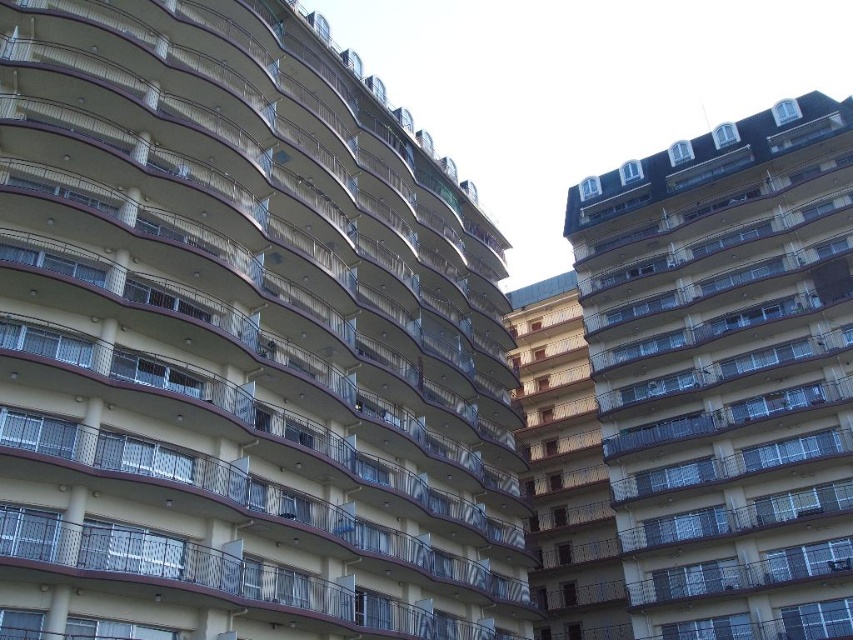
Identify the location of beige concrete building at center. (242, 340).

Between beige concrete building at center and beige concrete balcony at center, which one has more height?

With more height is beige concrete building at center.

Describe the element at coordinates (242, 340) in the screenshot. I see `beige concrete building at center` at that location.

Locate an element on the screen. The height and width of the screenshot is (640, 853). beige concrete building at center is located at coordinates (x=242, y=340).

Is beige concrete building at center thinner than beige concrete building at upper right?

Incorrect, beige concrete building at center's width is not less than beige concrete building at upper right's.

Who is more forward, [36,310] or [822,336]?

Positioned in front is point [36,310].

The height and width of the screenshot is (640, 853). Identify the location of beige concrete building at center. (242, 340).

Does point (849, 323) come farther from viewer compared to point (556, 568)?

No.

Can you confirm if beige concrete building at upper right is wider than beige concrete balcony at center?

Yes.

Is point (833, 227) closer to viewer compared to point (534, 465)?

Yes, it is.

Where is `beige concrete building at upper right`? beige concrete building at upper right is located at coordinates [x=727, y=372].